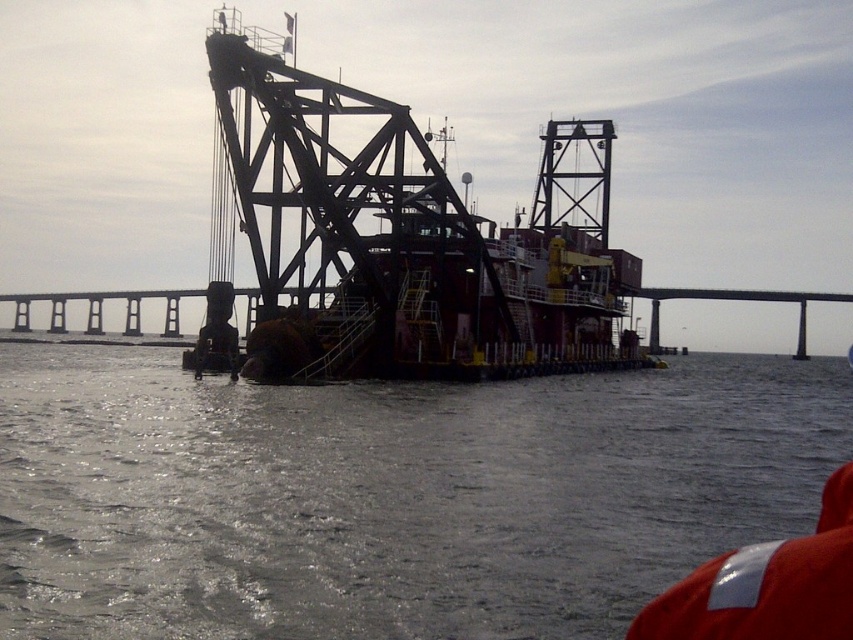
You are standing on the deck of the vessel and need to move from the point at coordinate point at point (373, 580) to another location. The distance between these two points is 64.17 meters. If your walking speed is 1.5 meters per second, how many seconds will it take you to walk this distance?

The distance between the point at point (373, 580) and the other location is 64.17 meters. At a walking speed of 1.5 meters per second, it would take 64.17 divided by 1.5, which equals approximately 42.78 seconds. So, it will take about 42.8 seconds to walk the distance.

You are a maritime engineer inspecting the vessel from above. You notice the gray matte water at center and the metallic structure at center. Which of these two has a larger area coverage on the deck?

The metallic structure at center has a larger area coverage than the gray matte water at center.

You are a crane operator on the vessel and need to move a heavy container from the deck to the concrete bridge at center. The metallic structure at center is in the way. Can you move the container around it to reach the bridge?

The metallic structure at center is positioned on the left side of concrete bridge at center, so you can move the container around the metallic structure at center to the right side to reach the concrete bridge at center.